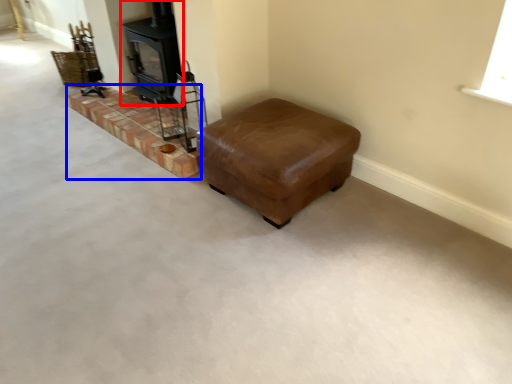
Question: Which object appears closest to the camera in this image, wood burning stove (highlighted by a red box) or stairwell (highlighted by a blue box)?

Choices:
 (A) wood burning stove
 (B) stairwell

Answer: (B)